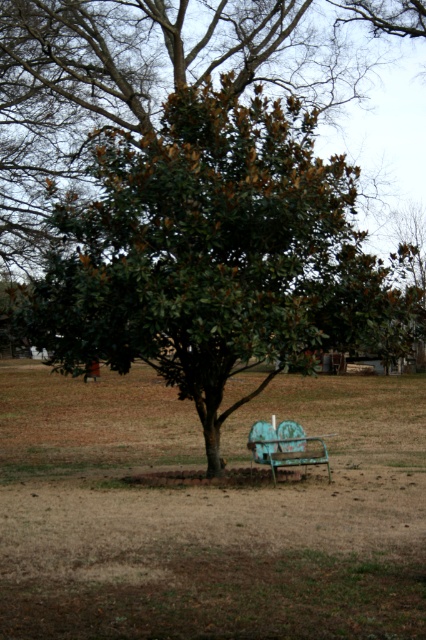
You are a gardener planning to plant a new flower bed between the brown dry grass at center and the green leafy tree at center. The flower bed requires a minimum of 3 meters of space. Can you fit it there?

The distance between the brown dry grass at center and the green leafy tree at center is 4.10 meters, which is more than the required 3 meters. Therefore, the flower bed can be planted there.

You are standing in the outdoor scene and want to place a small potted plant between the two points, point (x=293, y=276) and point (x=314, y=460). Which point should the plant be closer to in order to be closer to the viewer?

The plant should be closer to point (x=293, y=276) because it is closer to the viewer than point (x=314, y=460).